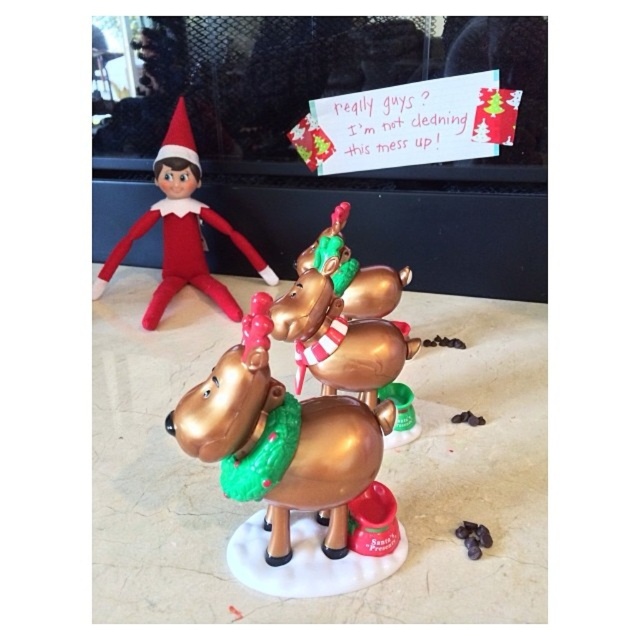
In the scene shown: Can you confirm if gold metallic reindeer at center is bigger than velvety red elf at upper left?

No, gold metallic reindeer at center is not bigger than velvety red elf at upper left.

Measure the distance between gold metallic reindeer at center and velvety red elf at upper left.

gold metallic reindeer at center is 33.84 inches away from velvety red elf at upper left.

Is point (273, 433) closer to camera compared to point (124, 236)?

Yes, point (273, 433) is in front of point (124, 236).

This screenshot has height=640, width=640. Identify the location of gold metallic reindeer at center. (282, 445).

Can you confirm if velvety red elf at upper left is positioned below metallic gold reindeer at center?

No.

At what (x,y) coordinates should I click in order to perform the action: click on velvety red elf at upper left. Please return your answer as a coordinate pair (x, y). The image size is (640, 640). Looking at the image, I should click on (180, 228).

Looking at this image, is gold metallic reindeer at center bigger than metallic gold reindeer at center?

Indeed, gold metallic reindeer at center has a larger size compared to metallic gold reindeer at center.

In the scene shown: Does gold metallic reindeer at center have a greater height compared to metallic gold reindeer at center?

Yes, gold metallic reindeer at center is taller than metallic gold reindeer at center.

I want to click on gold metallic reindeer at center, so click(x=282, y=445).